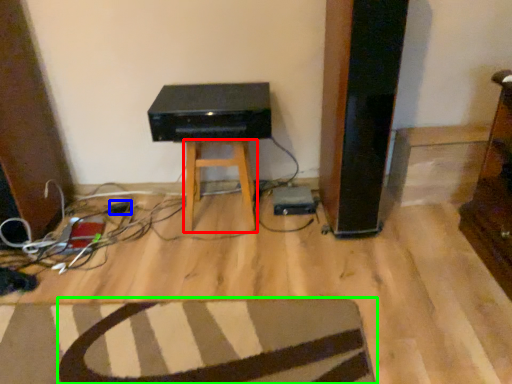
Question: Based on their relative distances, which object is nearer to stool (highlighted by a red box)? Choose from plug (highlighted by a blue box) and furniture (highlighted by a green box).

Choices:
 (A) plug
 (B) furniture

Answer: (A)